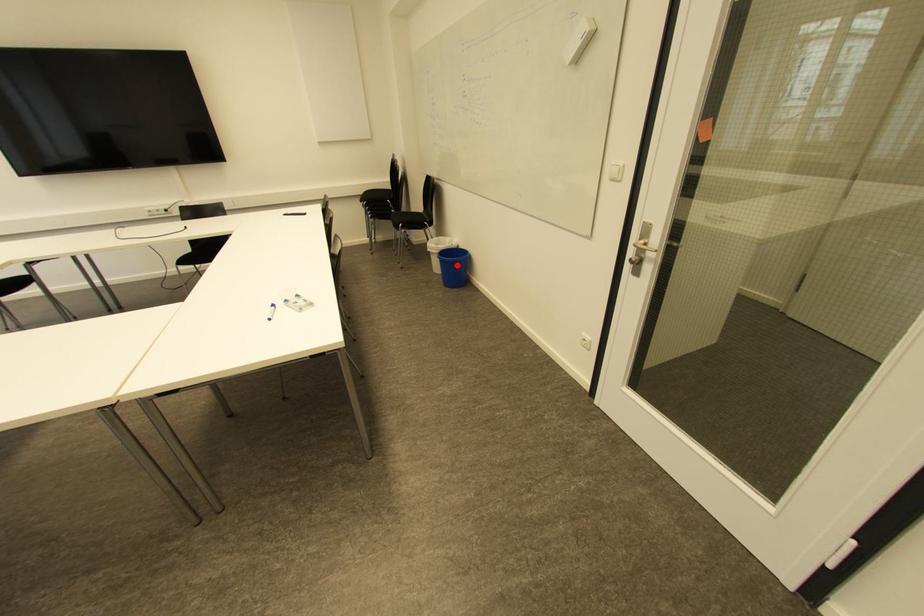
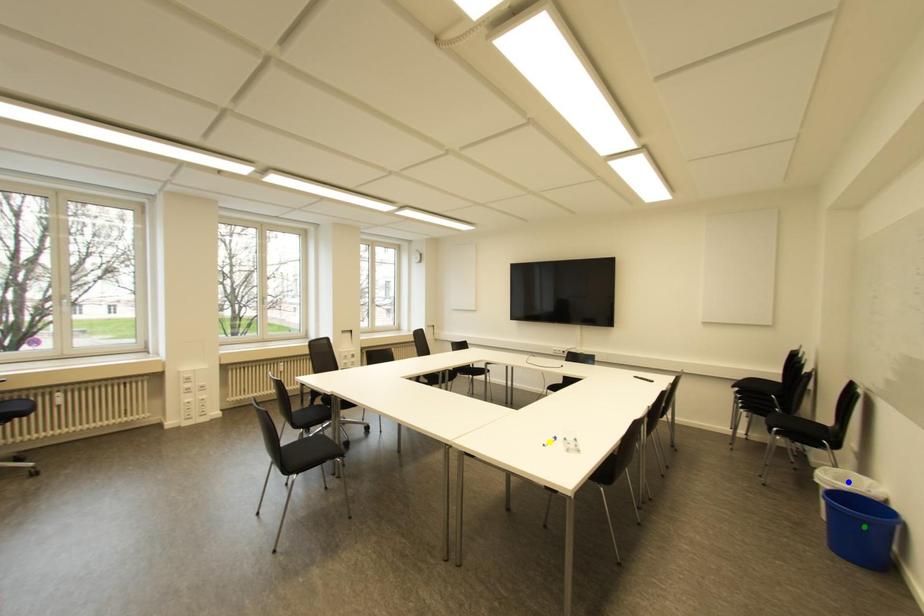
Question: I am providing you with two images of the same scene from different viewpoints. A red point is marked on the first image. You are given multiple points on the second image. Which point in image 2 represents the same 3d spot as the red point in image 1?

Choices:
 (A) yellow point
 (B) green point
 (C) blue point

Answer: (B)